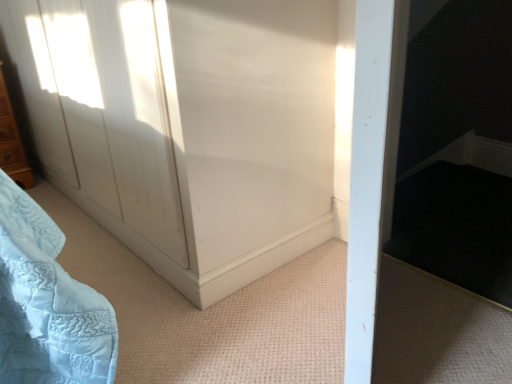
Question: Is white glossy door at upper left inside the boundaries of wooden dresser at left, or outside?

Choices:
 (A) outside
 (B) inside

Answer: (A)

Question: Considering the positions of white glossy door at upper left and wooden dresser at left in the image, is white glossy door at upper left taller or shorter than wooden dresser at left?

Choices:
 (A) short
 (B) tall

Answer: (B)

Question: Looking at their shapes, would you say white glossy door at upper left is wider or thinner than wooden dresser at left?

Choices:
 (A) wide
 (B) thin

Answer: (A)

Question: In terms of width, does wooden dresser at left look wider or thinner when compared to white glossy door at upper left?

Choices:
 (A) wide
 (B) thin

Answer: (B)

Question: From a real-world perspective, relative to white glossy door at upper left, is wooden dresser at left vertically above or below?

Choices:
 (A) below
 (B) above

Answer: (A)

Question: From the image's perspective, relative to white glossy door at upper left, is wooden dresser at left above or below?

Choices:
 (A) below
 (B) above

Answer: (A)

Question: In terms of size, does wooden dresser at left appear bigger or smaller than white glossy door at upper left?

Choices:
 (A) big
 (B) small

Answer: (B)